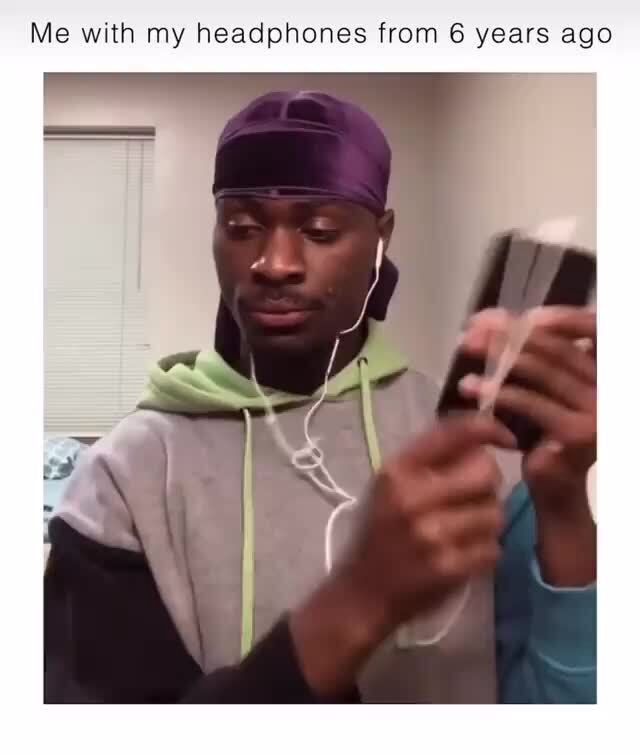
Locate an element on the screen. white wall is located at coordinates (182, 210), (504, 167).